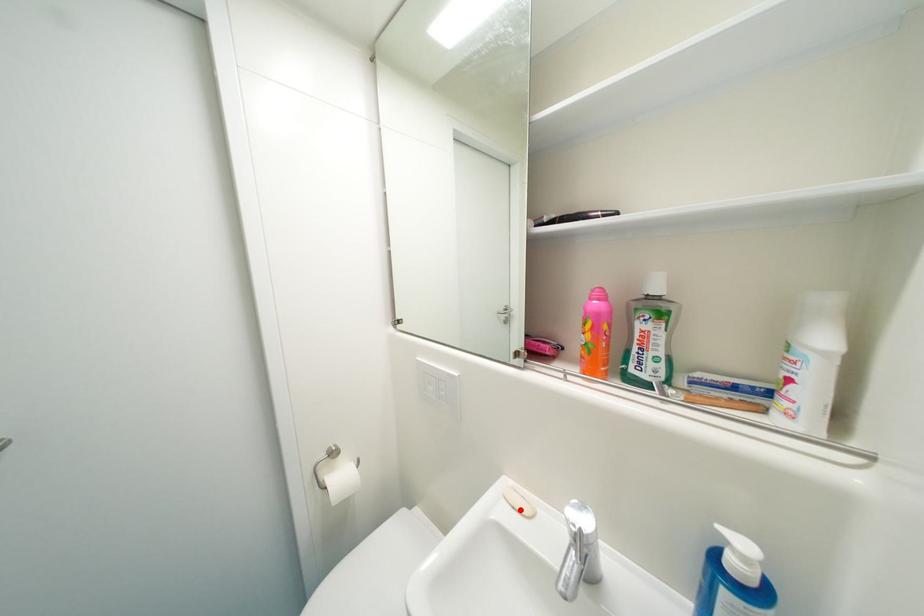
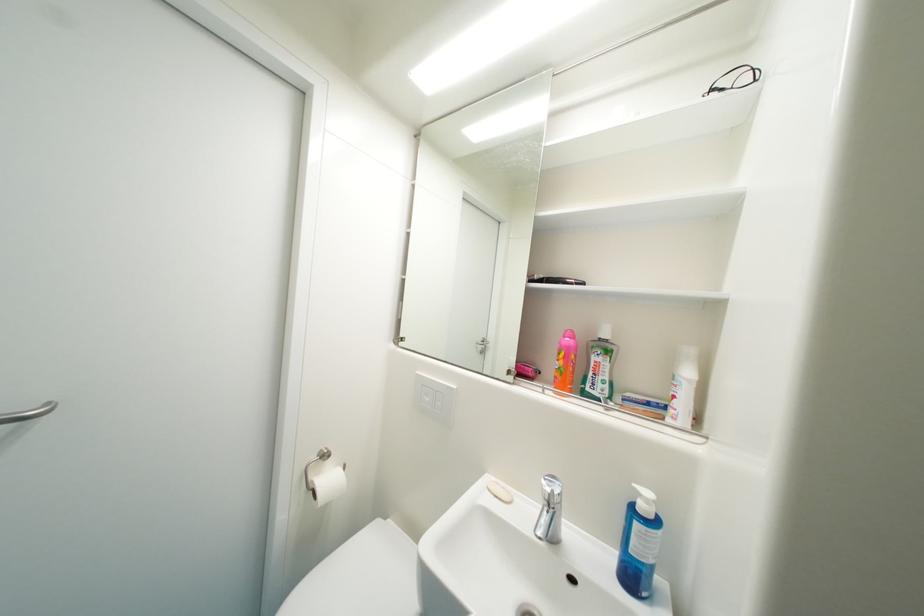
Where in the second image is the point corresponding to the highlighted location from the first image?

(503, 498)